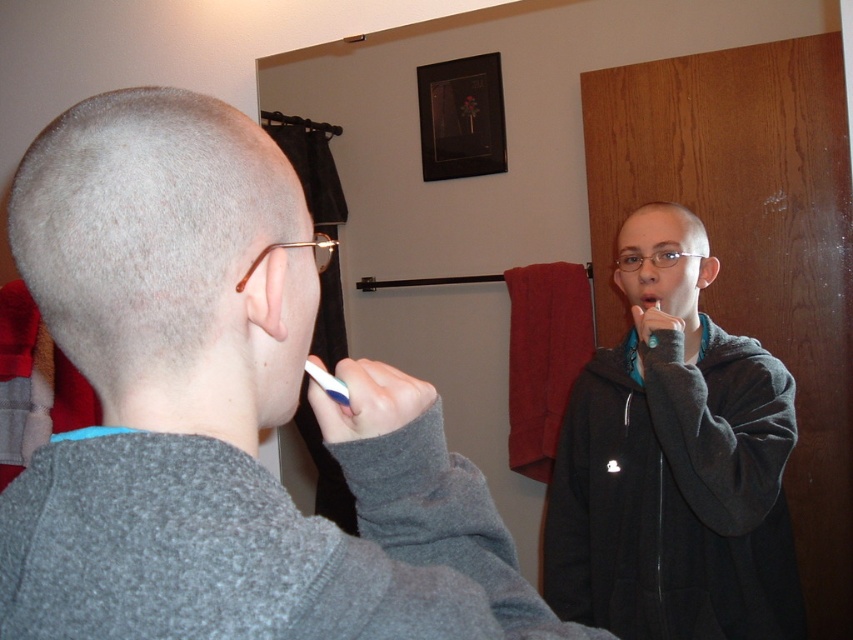
Who is shorter, gray matte sweatshirt at upper left or matte plastic mouth at center?

matte plastic mouth at center

This screenshot has width=853, height=640. Describe the element at coordinates (222, 410) in the screenshot. I see `gray matte sweatshirt at upper left` at that location.

Locate an element on the screen. Image resolution: width=853 pixels, height=640 pixels. gray matte sweatshirt at upper left is located at coordinates (222, 410).

Identify the location of gray matte sweatshirt at upper left. 222,410.

Does white plastic toothbrush at left have a smaller size compared to matte plastic mouth at center?

Actually, white plastic toothbrush at left might be larger than matte plastic mouth at center.

Which of these two, white plastic toothbrush at left or matte plastic mouth at center, stands shorter?

matte plastic mouth at center is shorter.

Identify the location of white plastic toothbrush at left. Image resolution: width=853 pixels, height=640 pixels. (328, 384).

Which is more to the left, gray matte sweatshirt at upper left or black fleece sweatshirt at right?

gray matte sweatshirt at upper left is more to the left.

Which is above, gray matte sweatshirt at upper left or black fleece sweatshirt at right?

gray matte sweatshirt at upper left is above.

Between point (456, 602) and point (712, 520), which one is positioned in front?

Point (456, 602) is in front.

I want to click on gray matte sweatshirt at upper left, so click(222, 410).